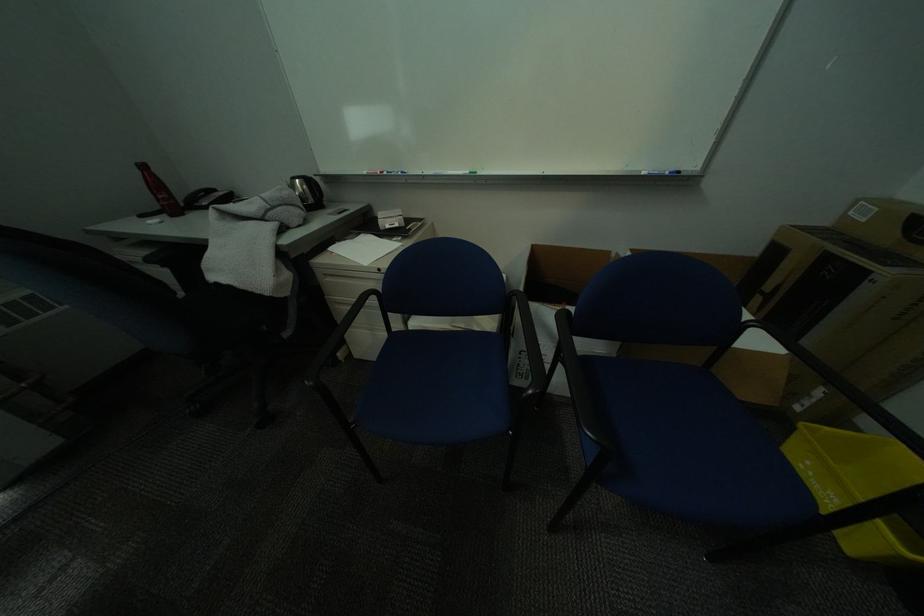
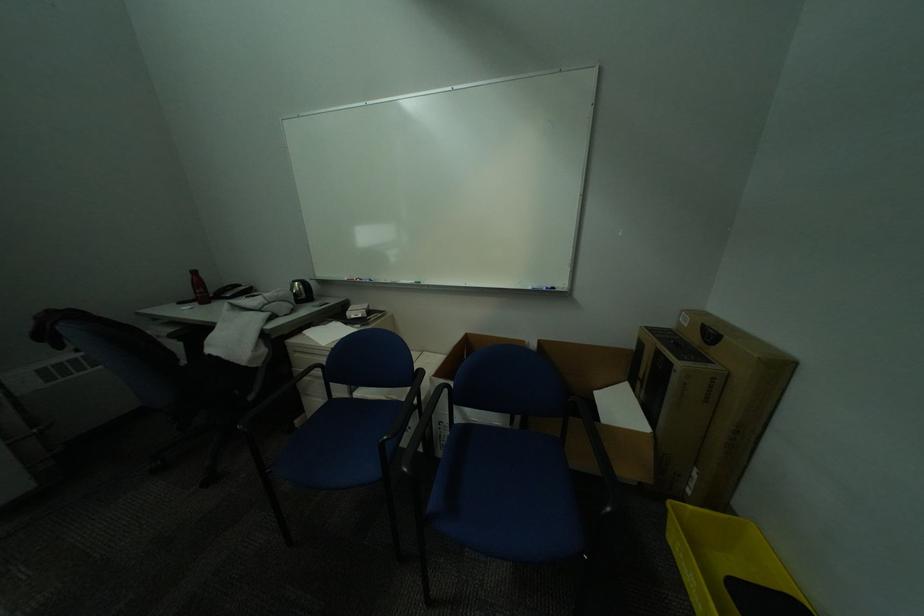
Locate, in the second image, the point that corresponds to point (839, 430) in the first image.

(701, 508)